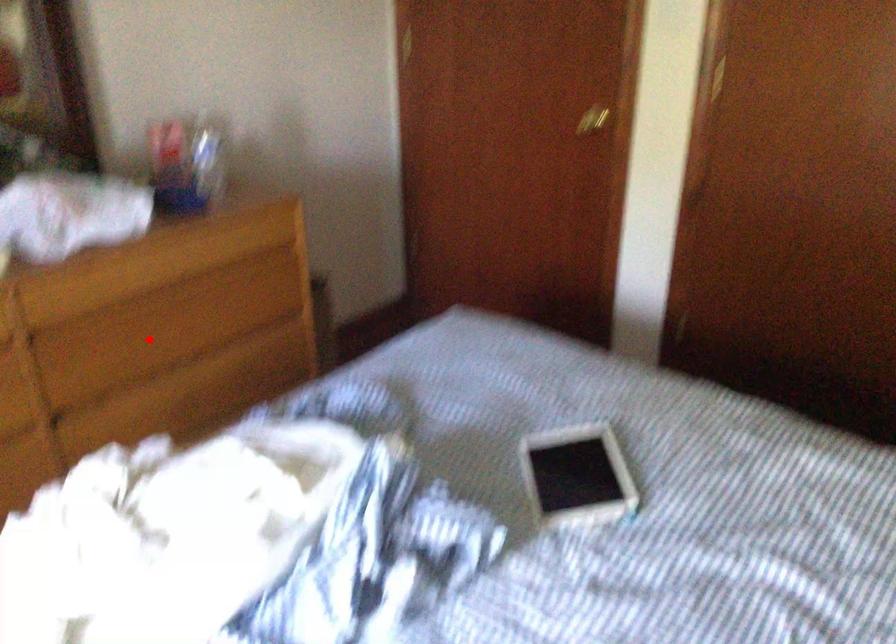
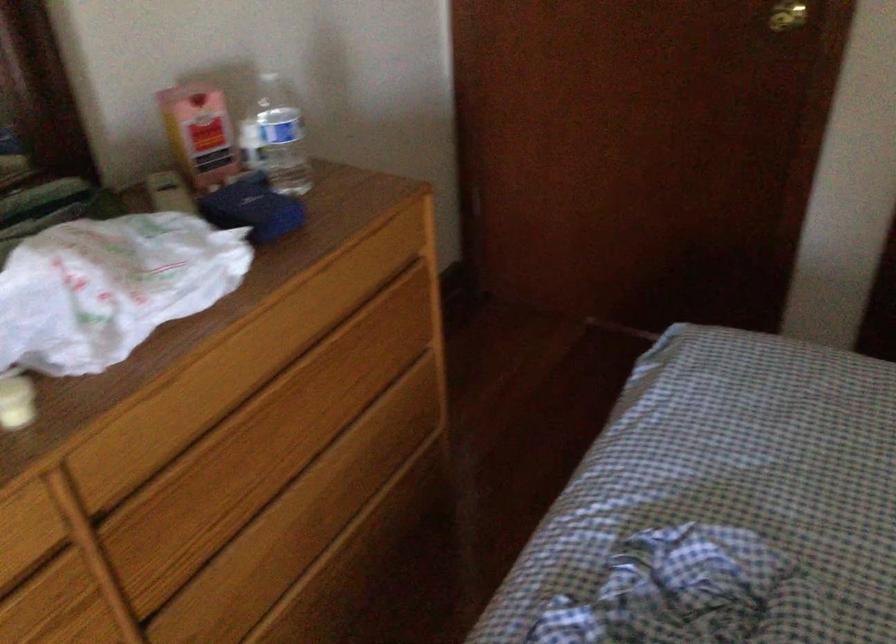
Question: I am providing you with two images of the same scene from different viewpoints. A red point is shown in image1. For the corresponding object point in image2, is it positioned nearer or farther from the camera?

Choices:
 (A) Nearer
 (B) Farther

Answer: (A)